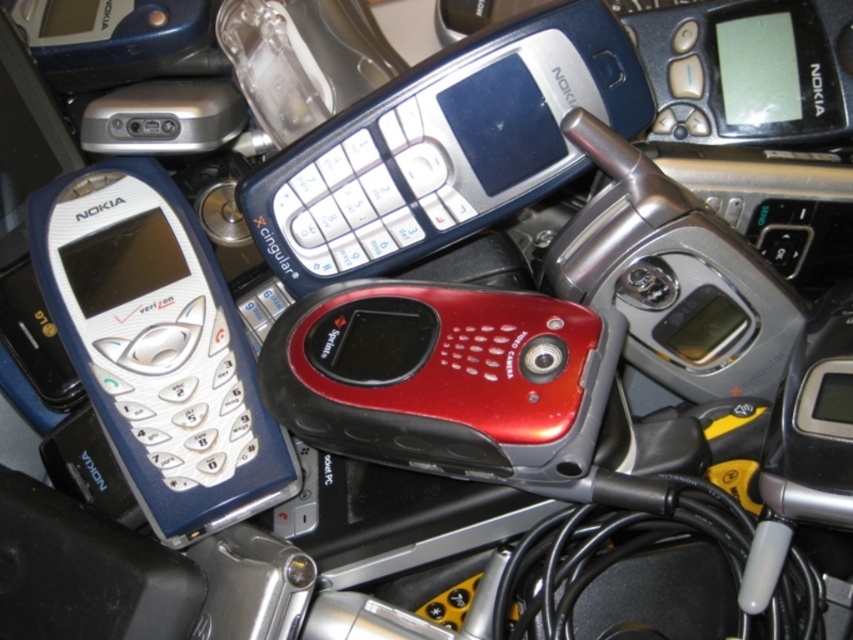
Between point (534, 180) and point (194, 401), which one is positioned behind?

The point (534, 180) is more distant.

Locate an element on the screen. metallic blue nokia phone at upper center is located at coordinates (444, 147).

Is metallic blue nokia phone at upper center wider than shiny red plastic phone at center?

Yes.

Does metallic blue nokia phone at upper center come in front of shiny red plastic phone at center?

That is False.

Identify the location of metallic blue nokia phone at upper center. (444, 147).

This screenshot has height=640, width=853. What are the coordinates of `matte silver phone at left` in the screenshot? It's located at (158, 348).

Between matte silver phone at left and shiny red plastic phone at center, which one has less height?

shiny red plastic phone at center

This screenshot has height=640, width=853. I want to click on matte silver phone at left, so click(x=158, y=348).